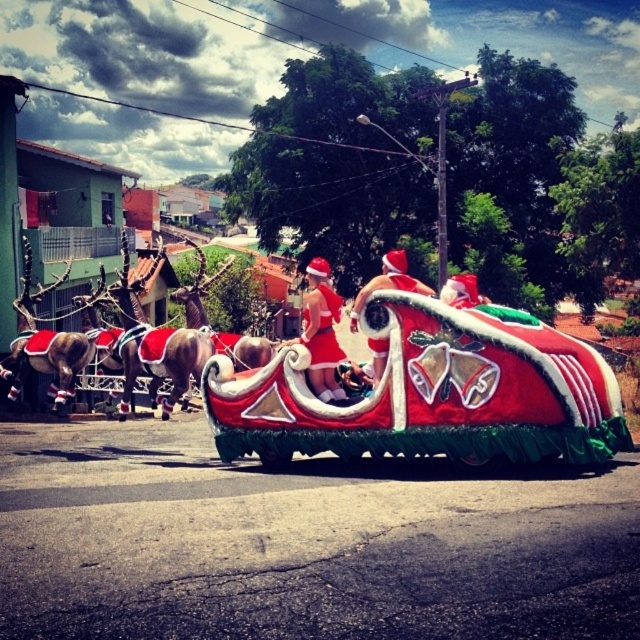
Who is more distant from viewer, (502, 378) or (387, 348)?

The point (387, 348) is behind.

Does point (481, 316) come farther from viewer compared to point (368, 284)?

No, it is in front of (368, 284).

Is point (260, 403) in front of point (362, 289)?

No, (260, 403) is further to viewer.

Locate an element on the screen. The width and height of the screenshot is (640, 640). shiny red fabric wagon at center is located at coordinates (429, 392).

Can you confirm if red velvet dress at center is positioned below red velvet santa hat at center?

Yes.

Is red velvet dress at center above red velvet santa hat at center?

No, red velvet dress at center is not above red velvet santa hat at center.

Between point (326, 365) and point (397, 278), which one is positioned behind?

The point (326, 365) is more distant.

This screenshot has height=640, width=640. Identify the location of red velvet dress at center. (321, 332).

Is shiny red fabric wagon at center to the left of red velvet dress at center from the viewer's perspective?

Incorrect, shiny red fabric wagon at center is not on the left side of red velvet dress at center.

Which is above, shiny red fabric wagon at center or red velvet dress at center?

red velvet dress at center

Is point (282, 419) positioned in front of point (323, 275)?

Yes, point (282, 419) is closer to viewer.

Locate an element on the screen. shiny red fabric wagon at center is located at coordinates point(429,392).